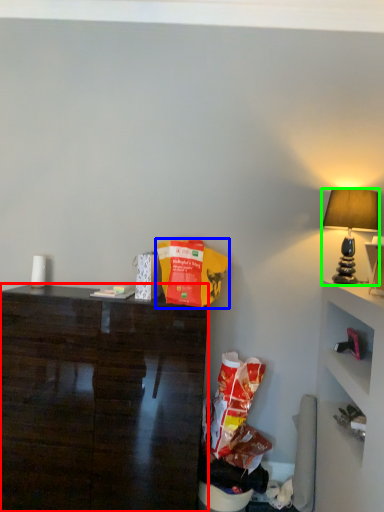
Question: Considering the real-world distances, which object is farthest from desk (highlighted by a red box)? paper bag (highlighted by a blue box) or lamp (highlighted by a green box)?

Choices:
 (A) paper bag
 (B) lamp

Answer: (B)